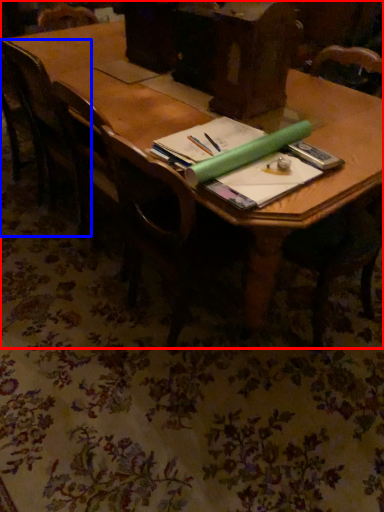
Question: Among these objects, which one is nearest to the camera, table (highlighted by a red box) or chair (highlighted by a blue box)?

Choices:
 (A) table
 (B) chair

Answer: (A)